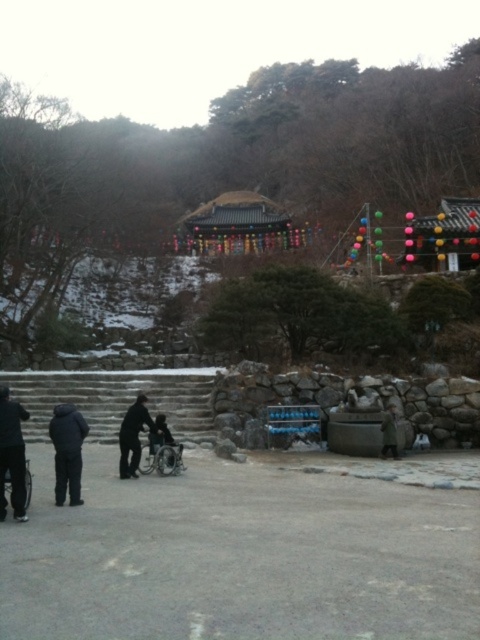
Question: Is dark gray pants at lower left to the right of green woolen coat at lower right from the viewer's perspective?

Choices:
 (A) yes
 (B) no

Answer: (B)

Question: Which point is farther to the camera?

Choices:
 (A) stone steps at center
 (B) dark gray pants at lower left

Answer: (A)

Question: Which of the following is the farthest from the observer?

Choices:
 (A) black matte jacket at lower left
 (B) green woolen coat at lower right

Answer: (B)

Question: Is stone steps at center further to camera compared to silver metallic wheelchair at lower left?

Choices:
 (A) no
 (B) yes

Answer: (B)

Question: Is the position of silver metallic wheelchair at center less distant than that of green woolen coat at lower right?

Choices:
 (A) no
 (B) yes

Answer: (B)

Question: Based on their relative distances, which object is nearer to the silver metallic wheelchair at lower left?

Choices:
 (A) dark gray wheelchair at center
 (B) silver metallic wheelchair at center

Answer: (B)